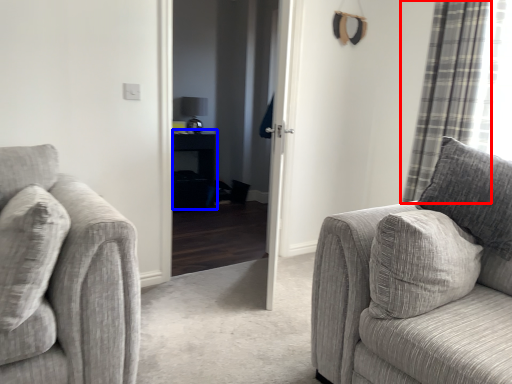
Question: Which point is closer to the camera, curtain (highlighted by a red box) or table (highlighted by a blue box)?

Choices:
 (A) curtain
 (B) table

Answer: (A)